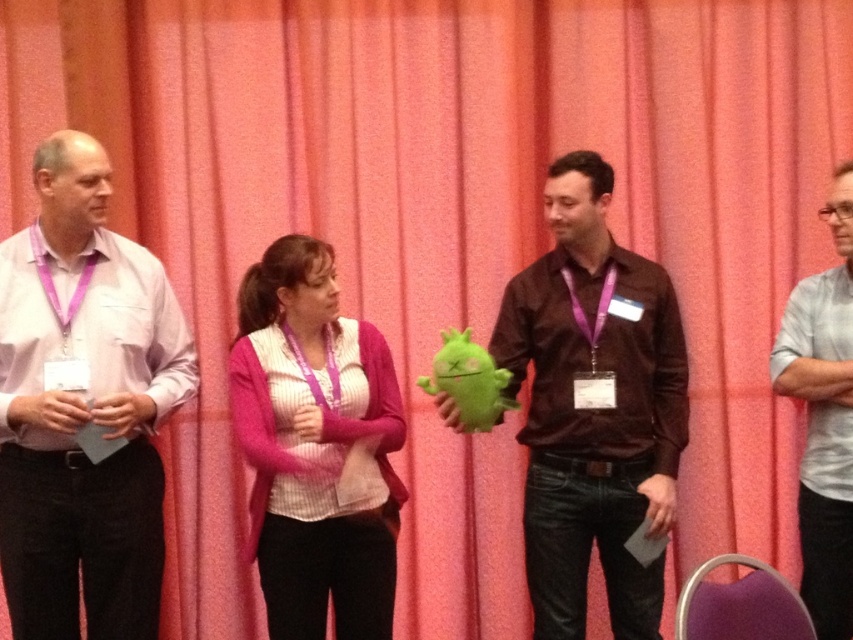
You are standing in the room and want to move from the point marked as point (144, 276) to the point marked as point (660, 481). Is the destination point in front of or behind you?

The destination point marked as point (660, 481) is in front of you because the starting point point (144, 276) is behind point (660, 481).

Looking at the scene, which clothing item is positioned higher between the matte brown shirt at center and the pink fuzzy sweater at center?

The matte brown shirt at center is positioned higher than the pink fuzzy sweater at center.

Based on the scene description, which individual is wearing a shirt that is larger in size between the matte brown shirt at center and the white shirt at right?

The matte brown shirt at center is bigger than the white shirt at right.